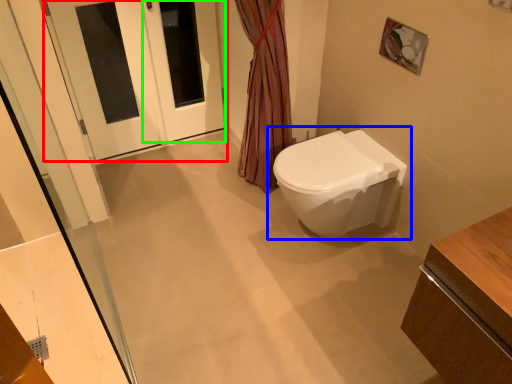
Question: Considering the real-world distances, which object is farthest from door (highlighted by a red box)? toilet (highlighted by a blue box) or screen door (highlighted by a green box)?

Choices:
 (A) toilet
 (B) screen door

Answer: (A)